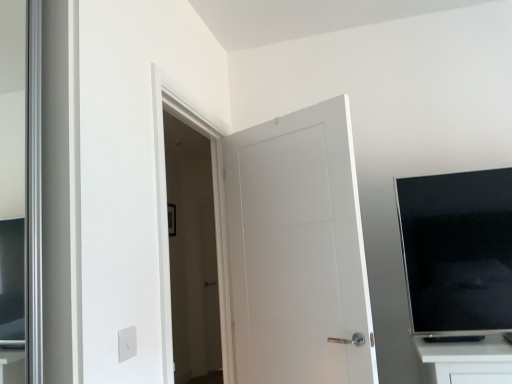
Question: Is black glossy tv at upper right in front of or behind white matte door at center in the image?

Choices:
 (A) front
 (B) behind

Answer: (A)

Question: Does point (507, 291) appear closer or farther from the camera than point (294, 370)?

Choices:
 (A) farther
 (B) closer

Answer: (B)

Question: Is black glossy tv at upper right inside the boundaries of white matte door at center, or outside?

Choices:
 (A) inside
 (B) outside

Answer: (B)

Question: Considering their positions, is white matte door at center located in front of or behind black glossy tv at upper right?

Choices:
 (A) front
 (B) behind

Answer: (B)

Question: In the image, is white matte door at center on the left side or the right side of black glossy tv at upper right?

Choices:
 (A) right
 (B) left

Answer: (B)

Question: From their relative heights in the image, would you say white matte door at center is taller or shorter than black glossy tv at upper right?

Choices:
 (A) tall
 (B) short

Answer: (A)

Question: Do you think white matte door at center is within black glossy tv at upper right, or outside of it?

Choices:
 (A) outside
 (B) inside

Answer: (A)